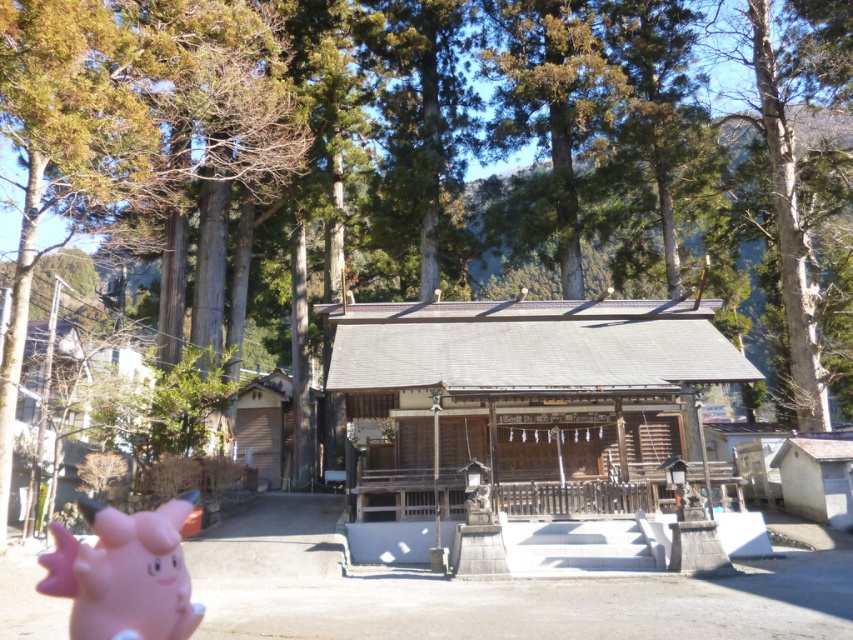
You are standing at the entrance of the shrine and want to take a photo of both the white wood hut at lower right and the wooden gate at left. Which object should you frame first in your camera viewfinder to ensure both are in the shot?

You should frame the wooden gate at left first because the white wood hut at lower right is closer to the viewer, so adjusting the camera to include the farther wooden gate at left will naturally include the closer hut in the frame.

You are a visitor at the shrine and want to take a photo of the wooden gate at left and the white wood hut at lower right in the same frame. Based on their positions, which direction should you face to include both in your photo?

You should face towards the center of the shrine area because the white wood hut at lower right is to the right of the wooden gate at left, so positioning yourself in the center will allow both to be captured in the same frame.

You are a visitor at the shrine and want to take a photo of the wooden hut at center and the pink rubber piggy at lower left. Which object should you focus on first if you want to capture both in the same frame without moving the camera?

You should focus on the wooden hut at center first because it is taller than the pink rubber piggy at lower left, so adjusting the camera angle to include its height will naturally include the shorter piggy in the frame.